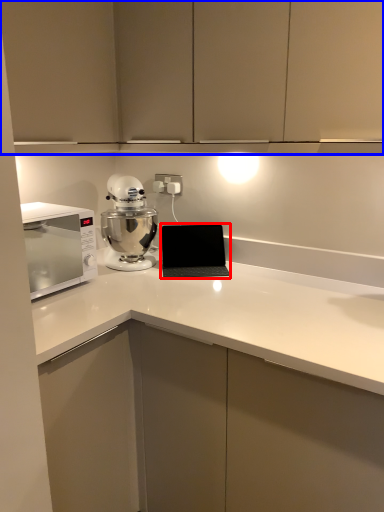
Question: Which object is closer to the camera taking this photo, laptop (highlighted by a red box) or cabinetry (highlighted by a blue box)?

Choices:
 (A) laptop
 (B) cabinetry

Answer: (B)